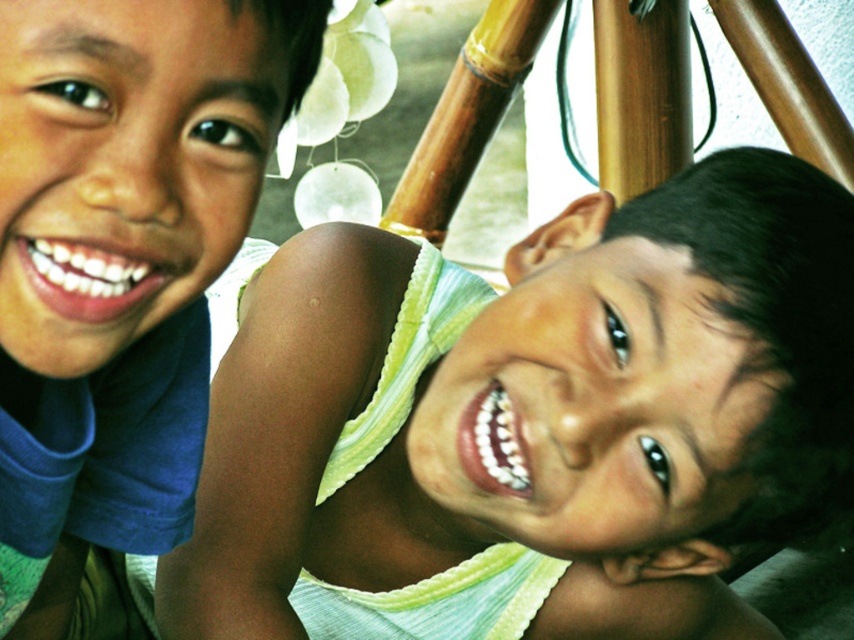
Question: Is matte green shirt at center wider than matte blue shirt at left?

Choices:
 (A) yes
 (B) no

Answer: (A)

Question: Is matte green shirt at center bigger than matte blue shirt at left?

Choices:
 (A) yes
 (B) no

Answer: (A)

Question: Can you confirm if matte green shirt at center is wider than matte blue shirt at left?

Choices:
 (A) no
 (B) yes

Answer: (B)

Question: Which object is closer to the camera taking this photo?

Choices:
 (A) matte blue shirt at left
 (B) matte green shirt at center

Answer: (A)